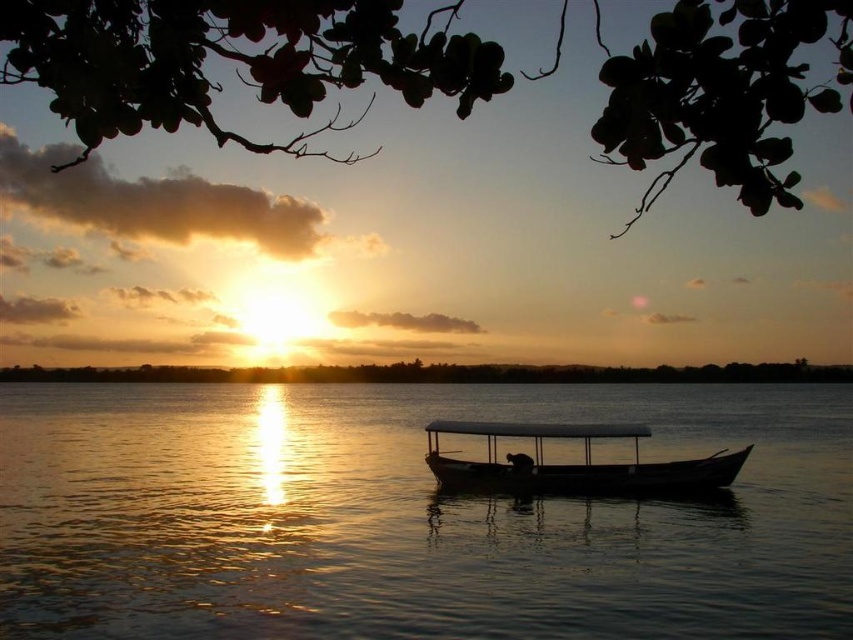
Question: Which point is closer to the camera?

Choices:
 (A) (428, 465)
 (B) (457, 525)

Answer: (B)

Question: Is silvery reflective water at center bigger than smooth wooden boat at center?

Choices:
 (A) no
 (B) yes

Answer: (B)

Question: Which of the following is the farthest from the observer?

Choices:
 (A) (720, 524)
 (B) (700, 483)

Answer: (B)

Question: Which of the following is the farthest from the observer?

Choices:
 (A) smooth wooden boat at center
 (B) silvery reflective water at center

Answer: (A)

Question: Is silvery reflective water at center smaller than smooth wooden boat at center?

Choices:
 (A) yes
 (B) no

Answer: (B)

Question: Can you confirm if silvery reflective water at center is positioned below smooth wooden boat at center?

Choices:
 (A) no
 (B) yes

Answer: (B)